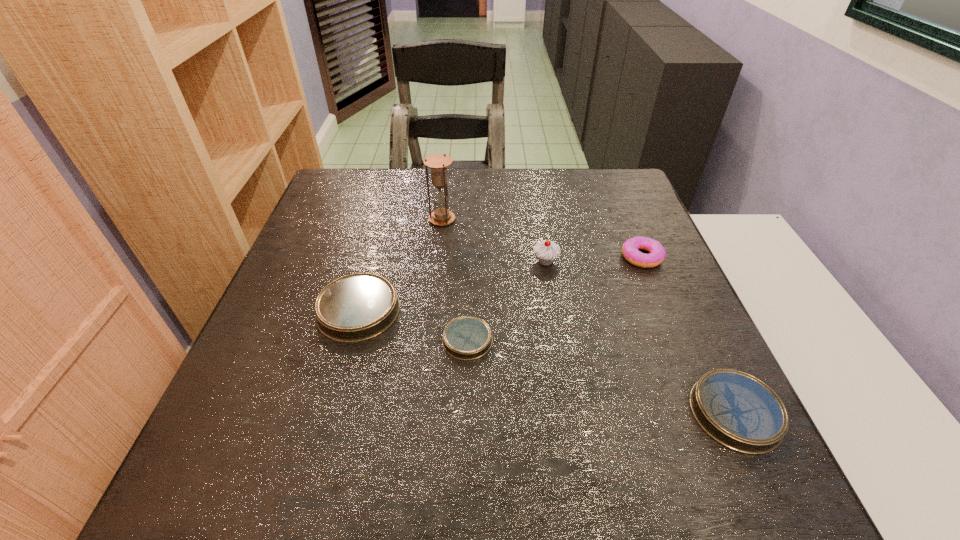
Where is `the leftmost object`? the leftmost object is located at coordinates (357, 307).

Where is `the second compass from right to left`? This screenshot has height=540, width=960. the second compass from right to left is located at coordinates (466, 338).

Locate an element on the screen. This screenshot has height=540, width=960. the shortest object is located at coordinates (466, 338).

You are a GUI agent. You are given a task and a screenshot of the screen. Output one action in this format:
    pyautogui.click(x=<x>, y=<y>)
    Task: Click on the rightmost compass
    
    Given the screenshot: What is the action you would take?
    pyautogui.click(x=737, y=410)

The image size is (960, 540). I want to click on the second tallest compass, so click(737, 410).

Where is `the tallest object`? the tallest object is located at coordinates (438, 163).

Locate an element on the screen. The height and width of the screenshot is (540, 960). the farthest object is located at coordinates (438, 163).

Locate an element on the screen. the fifth shortest object is located at coordinates (546, 251).

At what (x,y) coordinates should I click in order to perform the action: click on the fourth object from left to right. Please return your answer as a coordinate pair (x, y). This screenshot has width=960, height=540. Looking at the image, I should click on (546, 251).

Find the location of a particular element. This screenshot has height=540, width=960. doughnut is located at coordinates (630, 251).